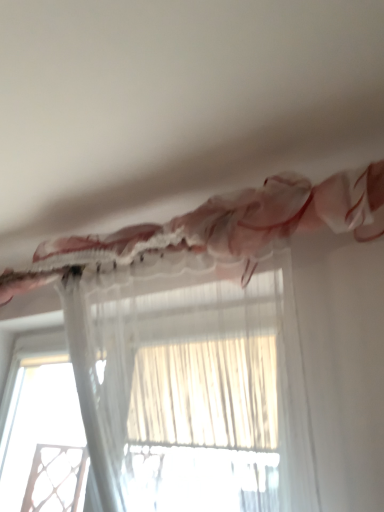
Question: From the image's perspective, is translucent sheer curtain at upper center, which is counted as the second curtain, starting from the top, positioned above or below transparent fabric at lower left?

Choices:
 (A) below
 (B) above

Answer: (B)

Question: Do you think translucent sheer curtain at upper center, marked as the 1th curtain in a bottom-to-top arrangement, is within transparent fabric at lower left, or outside of it?

Choices:
 (A) inside
 (B) outside

Answer: (B)

Question: Which of these objects is positioned farthest from the transparent fabric at lower left?

Choices:
 (A) translucent sheer curtain at upper center, the second curtain ordered from the bottom
 (B) translucent sheer curtain at upper center, marked as the 1th curtain in a bottom-to-top arrangement

Answer: (A)

Question: Which object is positioned closest to the translucent sheer curtain at upper center, the 1th curtain viewed from the top?

Choices:
 (A) transparent fabric at lower left
 (B) translucent sheer curtain at upper center, which is counted as the second curtain, starting from the top

Answer: (B)